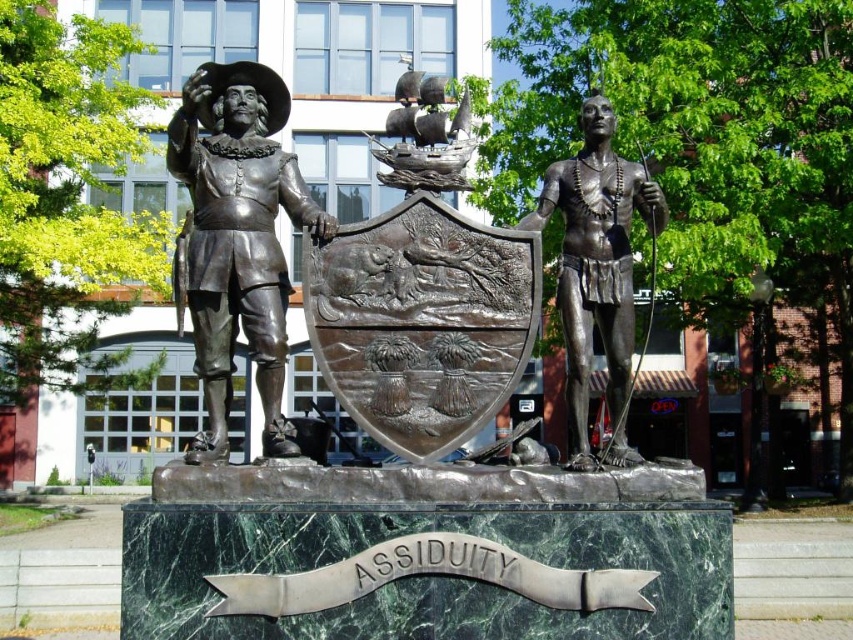
You are standing in front of the bronze statue in the public square. You notice two points marked on the statue. The first point is at coordinates point (454, 330) and the second point is at point (218, 145). Which of these two points is closer to your viewpoint?

Point (454, 330) is closer to the camera than point (218, 145).

You are standing at the point with coordinates [419,474] in the image. What object is located exactly at that point?

The bronze statue at center is located exactly at point [419,474].